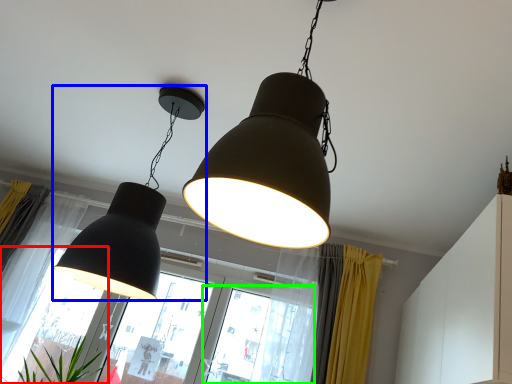
Question: Considering the real-world distances, which object is farthest from window (highlighted by a red box)? lamp (highlighted by a blue box) or window (highlighted by a green box)?

Choices:
 (A) lamp
 (B) window

Answer: (A)